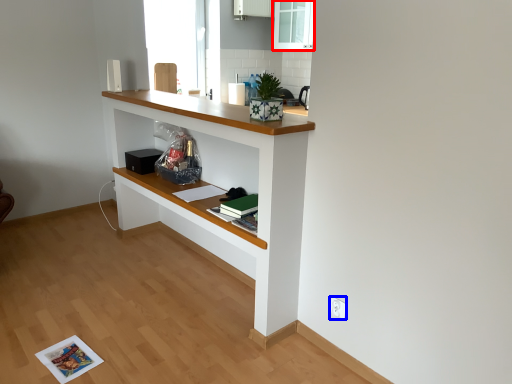
Question: Which point is closer to the camera, glass door (highlighted by a red box) or electric outlet (highlighted by a blue box)?

Choices:
 (A) glass door
 (B) electric outlet

Answer: (B)